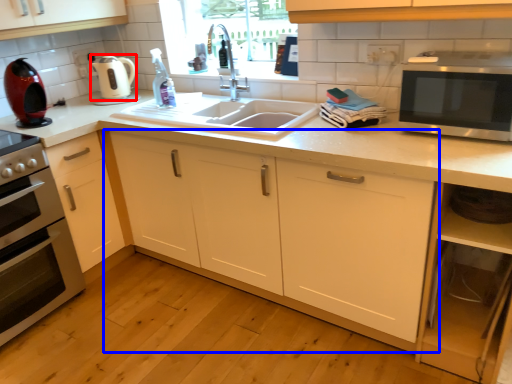
Question: Which point is closer to the camera, appliance (highlighted by a red box) or cabinetry (highlighted by a blue box)?

Choices:
 (A) appliance
 (B) cabinetry

Answer: (B)